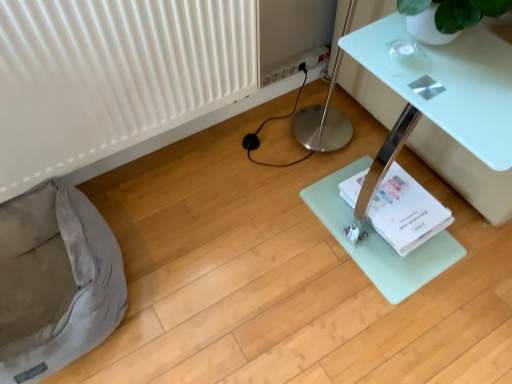
The height and width of the screenshot is (384, 512). Find the location of `vacant area that is situated to the right of gray fabric bean bag at lower left`. vacant area that is situated to the right of gray fabric bean bag at lower left is located at coordinates (200, 273).